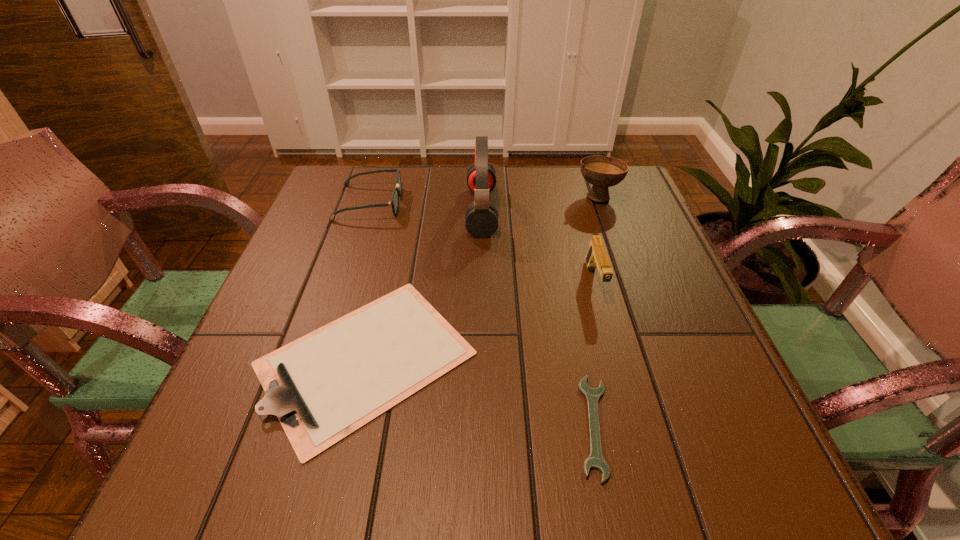
The image size is (960, 540). What are the coordinates of `vacant area that lies between the tallest object and the shortest object` in the screenshot? It's located at (538, 319).

Select which object is the fifth closest to the fourth shortest object. Please provide its 2D coordinates. Your answer should be formatted as a tuple, i.e. [(x, y)], where the tuple contains the x and y coordinates of a point satisfying the conditions above.

[(394, 202)]

At what (x,y) coordinates should I click in order to perform the action: click on object that stands as the fifth closest to the rightmost object. Please return your answer as a coordinate pair (x, y). Looking at the image, I should click on (595, 460).

Identify the location of vacant area that satisfies the following two spatial constraints: 1. on the face of the third shortest object; 2. on the back side of the third object from right to left. (297, 426).

The image size is (960, 540). Find the location of `vacant area in the image that satisfies the following two spatial constraints: 1. on the back side of the rightmost object; 2. on the left side of the clipboard`. vacant area in the image that satisfies the following two spatial constraints: 1. on the back side of the rightmost object; 2. on the left side of the clipboard is located at coordinates (403, 196).

I want to click on free location that satisfies the following two spatial constraints: 1. on the ear cups of the tallest object; 2. on the right side of the shortest object, so click(x=483, y=426).

The width and height of the screenshot is (960, 540). What are the coordinates of `free space that satisfies the following two spatial constraints: 1. on the front side of the soup bowl; 2. on the face of the fourth tallest object` in the screenshot? It's located at (601, 202).

Where is `free point that satisfies the following two spatial constraints: 1. on the face of the wrench; 2. on the left side of the spectacles`? free point that satisfies the following two spatial constraints: 1. on the face of the wrench; 2. on the left side of the spectacles is located at coordinates (297, 426).

Locate an element on the screen. The width and height of the screenshot is (960, 540). free space that satisfies the following two spatial constraints: 1. on the face of the fourth object from left to right; 2. on the right side of the spectacles is located at coordinates (x=297, y=426).